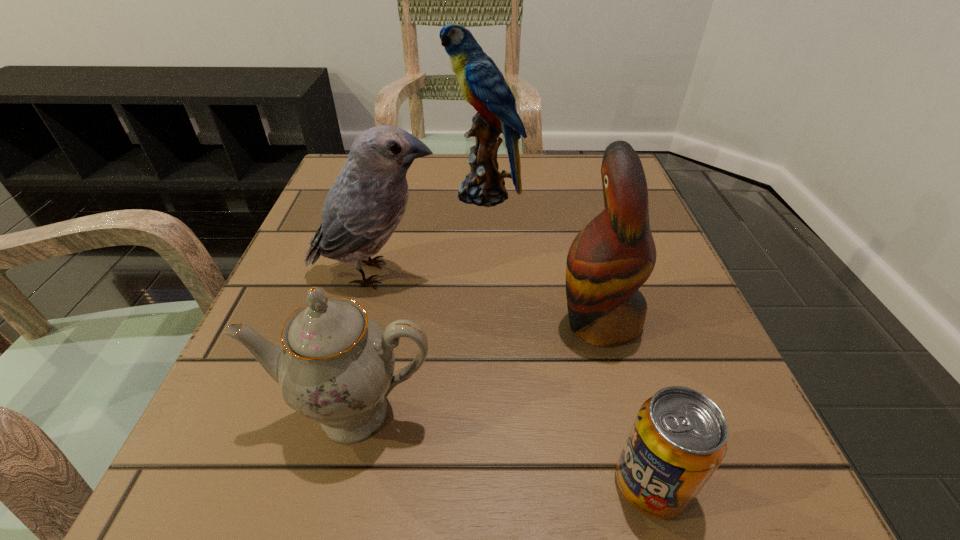
Where is `free space between the second farthest parrot and the third nearest object`? The height and width of the screenshot is (540, 960). free space between the second farthest parrot and the third nearest object is located at coordinates (488, 297).

You are a GUI agent. You are given a task and a screenshot of the screen. Output one action in this format:
    pyautogui.click(x=<x>, y=<y>)
    Task: Click on the vacant area that lies between the farthest parrot and the nearest parrot
    The width and height of the screenshot is (960, 540).
    Given the screenshot: What is the action you would take?
    coord(541,258)

Find the location of a particular element. empty space that is in between the second nearest parrot and the rightmost parrot is located at coordinates (488, 297).

At what (x,y) coordinates should I click in order to perform the action: click on free space between the farthest object and the nearest parrot. Please return your answer as a coordinate pair (x, y). The image size is (960, 540). Looking at the image, I should click on (541, 258).

Where is `empty location between the third nearest object and the farthest parrot`? The height and width of the screenshot is (540, 960). empty location between the third nearest object and the farthest parrot is located at coordinates (541, 258).

Find the location of a particular element. object that is the closest to the soda can is located at coordinates (609, 260).

Identify which object is the fourth closest to the fourth nearest object. Please provide its 2D coordinates. Your answer should be formatted as a tuple, i.e. [(x, y)], where the tuple contains the x and y coordinates of a point satisfying the conditions above.

[(679, 437)]

Locate an element on the screen. This screenshot has width=960, height=540. the second closest parrot relative to the chinaware is located at coordinates (609, 260).

Identify which parrot is located as the second nearest to the second shortest object. Please provide its 2D coordinates. Your answer should be formatted as a tuple, i.e. [(x, y)], where the tuple contains the x and y coordinates of a point satisfying the conditions above.

[(609, 260)]

Find the location of a particular element. The image size is (960, 540). free space that satisfies the following two spatial constraints: 1. on the face of the rightmost parrot; 2. on the left side of the shortest object is located at coordinates (643, 483).